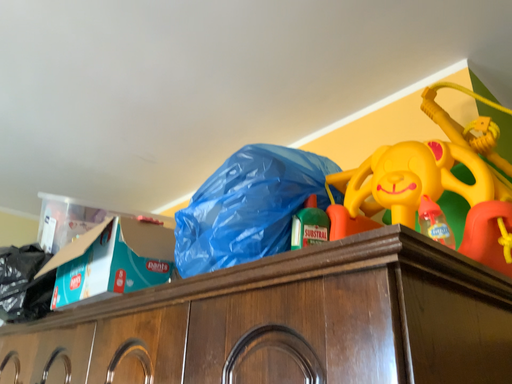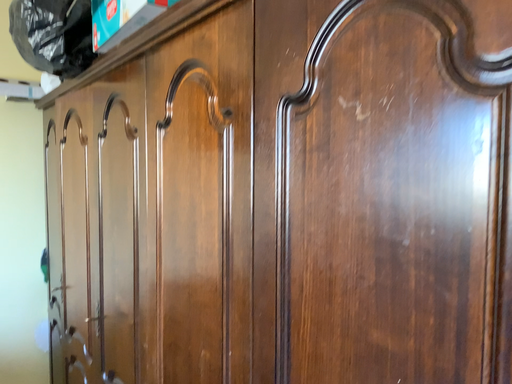
Question: How did the camera likely rotate when shooting the video?

Choices:
 (A) rotated right
 (B) rotated left

Answer: (B)